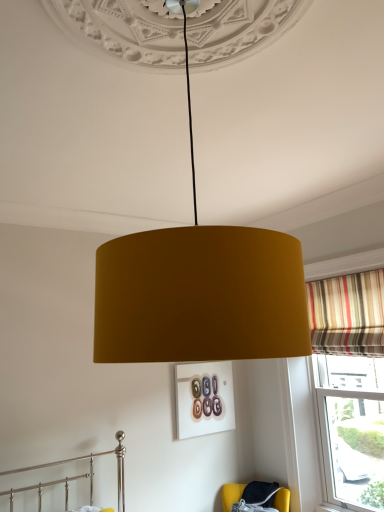
Question: Considering the relative sizes of striped fabric curtain at right and velvet yellow armchair at lower right in the image provided, is striped fabric curtain at right smaller than velvet yellow armchair at lower right?

Choices:
 (A) no
 (B) yes

Answer: (B)

Question: Can you confirm if striped fabric curtain at right is taller than velvet yellow armchair at lower right?

Choices:
 (A) no
 (B) yes

Answer: (B)

Question: From a real-world perspective, is striped fabric curtain at right located higher than velvet yellow armchair at lower right?

Choices:
 (A) yes
 (B) no

Answer: (A)

Question: Is striped fabric curtain at right not inside velvet yellow armchair at lower right?

Choices:
 (A) yes
 (B) no

Answer: (A)

Question: Is striped fabric curtain at right shorter than velvet yellow armchair at lower right?

Choices:
 (A) no
 (B) yes

Answer: (A)

Question: From a real-world perspective, relative to striped fabric curtain at right, is velvet yellow armchair at lower right vertically above or below?

Choices:
 (A) above
 (B) below

Answer: (B)

Question: In terms of size, does velvet yellow armchair at lower right appear bigger or smaller than striped fabric curtain at right?

Choices:
 (A) small
 (B) big

Answer: (B)

Question: Visually, is velvet yellow armchair at lower right positioned to the left or to the right of striped fabric curtain at right?

Choices:
 (A) right
 (B) left

Answer: (B)

Question: Relative to striped fabric curtain at right, is velvet yellow armchair at lower right in front or behind?

Choices:
 (A) front
 (B) behind

Answer: (B)

Question: Considering the positions of striped fabric curtain at right and velvet yellow armchair at lower right in the image, is striped fabric curtain at right wider or thinner than velvet yellow armchair at lower right?

Choices:
 (A) wide
 (B) thin

Answer: (B)

Question: Considering their positions, is striped fabric curtain at right located in front of or behind velvet yellow armchair at lower right?

Choices:
 (A) front
 (B) behind

Answer: (A)

Question: Based on their positions, is striped fabric curtain at right located to the left or right of velvet yellow armchair at lower right?

Choices:
 (A) right
 (B) left

Answer: (A)

Question: Considering the positions of striped fabric curtain at right and velvet yellow armchair at lower right in the image, is striped fabric curtain at right taller or shorter than velvet yellow armchair at lower right?

Choices:
 (A) short
 (B) tall

Answer: (B)

Question: From the image's perspective, is mustard fabric lampshade at center above or below striped fabric curtain at right?

Choices:
 (A) above
 (B) below

Answer: (A)

Question: From their relative heights in the image, would you say mustard fabric lampshade at center is taller or shorter than striped fabric curtain at right?

Choices:
 (A) short
 (B) tall

Answer: (B)